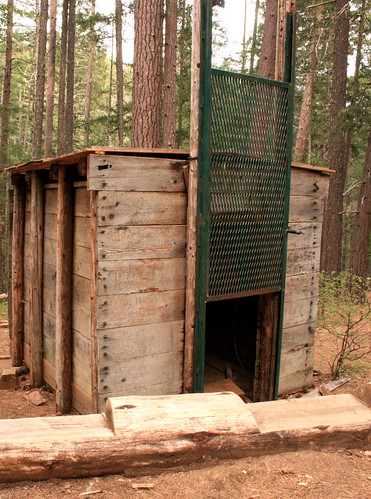
You are a GUI agent. You are given a task and a screenshot of the screen. Output one action in this format:
    pyautogui.click(x=<x>, y=<y>)
    Task: Click on the doorway
    This screenshot has height=499, width=371.
    Given the screenshot: What is the action you would take?
    pyautogui.click(x=230, y=347)